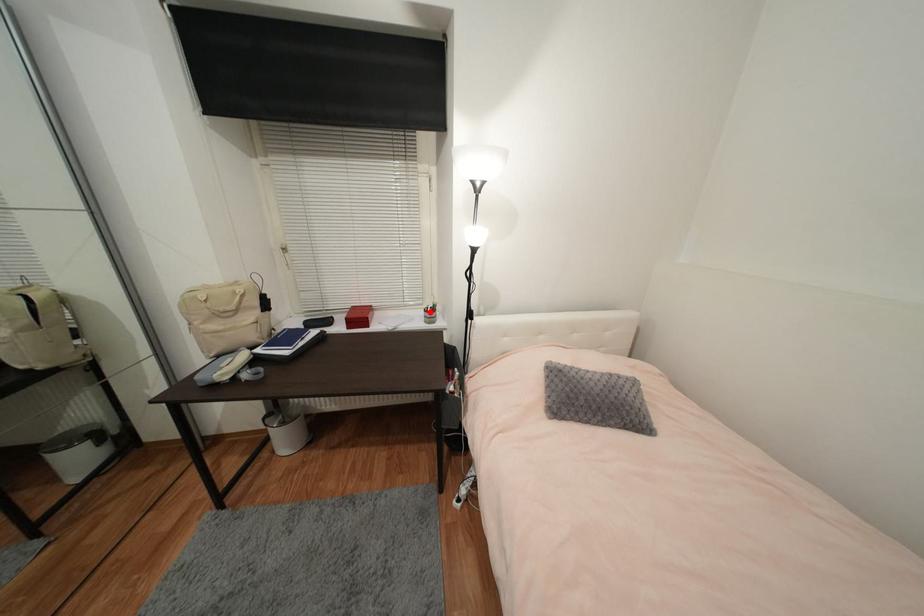
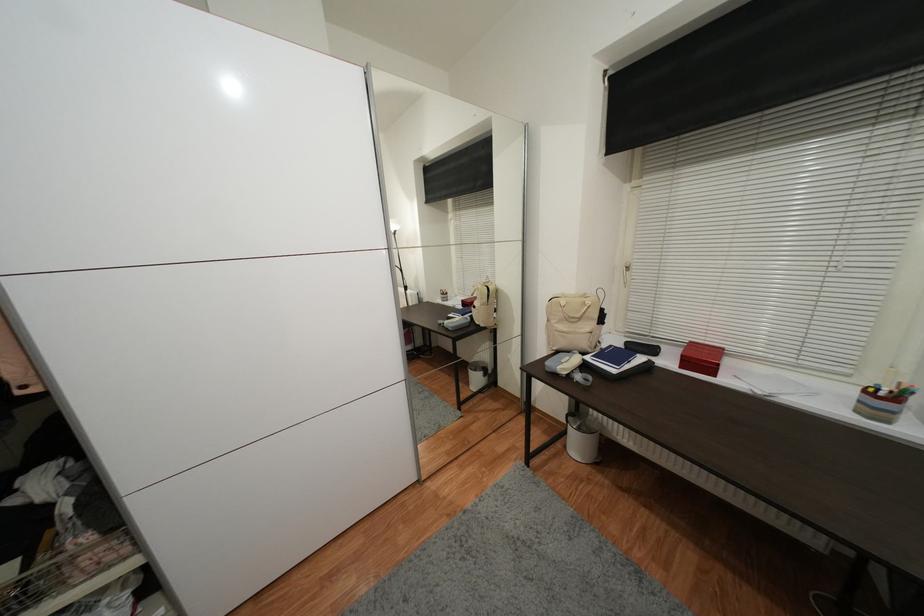
Locate, in the second image, the point that corresponds to the highlighted location in the first image.

(871, 392)